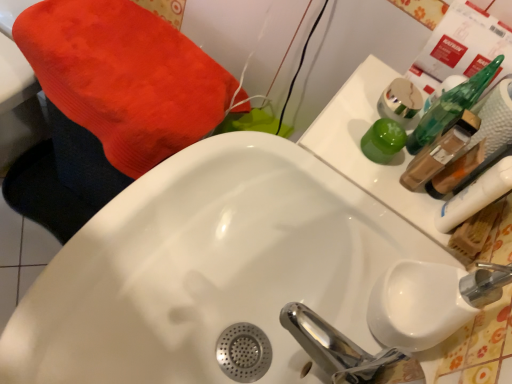
Locate an element on the screen. This screenshot has width=512, height=384. free location to the left of translucent plastic mouthwash at upper right, which is the 3th mouthwash in top-to-bottom order is located at coordinates (342, 147).